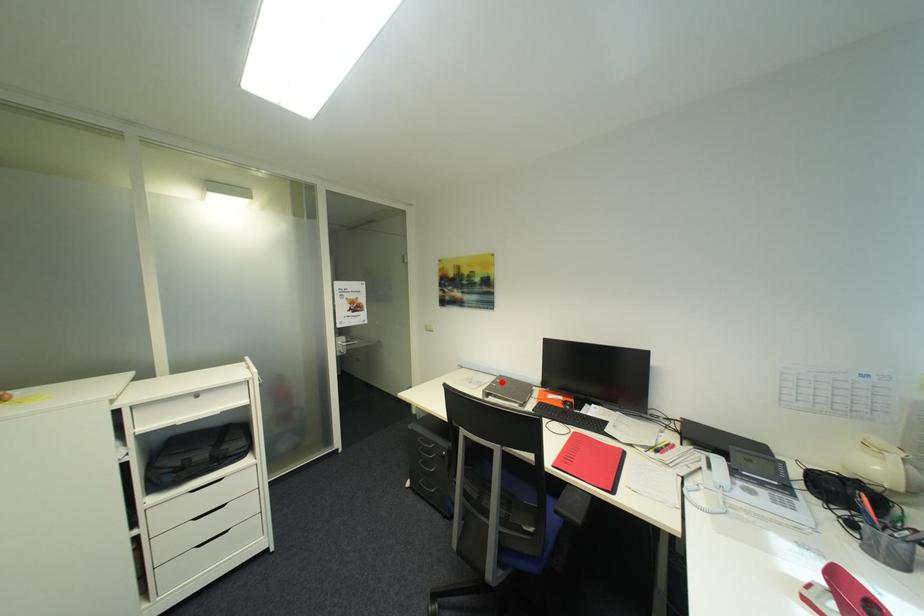
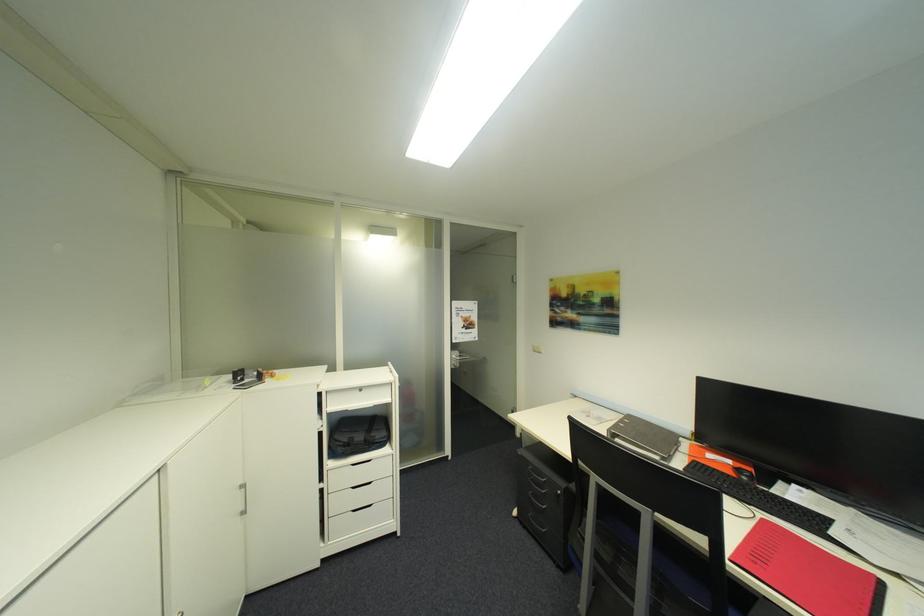
In the second image, find the point that corresponds to the highlighted location in the first image.

(628, 422)